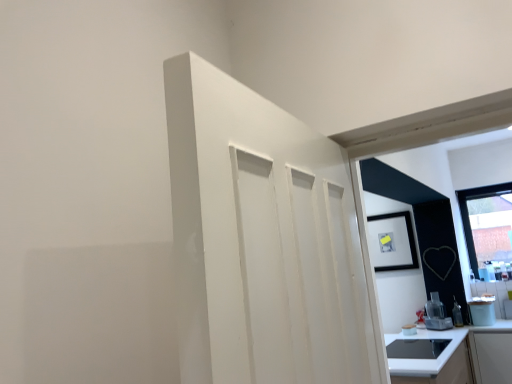
Question: Is satin silver blender at lower right, which is the second appliance from right to left, to the left of white glossy countertop at lower right from the viewer's perspective?

Choices:
 (A) no
 (B) yes

Answer: (A)

Question: From a real-world perspective, is satin silver blender at lower right, the 1th appliance positioned from the left, under white glossy countertop at lower right?

Choices:
 (A) yes
 (B) no

Answer: (B)

Question: From a real-world perspective, is satin silver blender at lower right, which is the second appliance from right to left, over white glossy countertop at lower right?

Choices:
 (A) yes
 (B) no

Answer: (A)

Question: Can you see satin silver blender at lower right, the 1th appliance positioned from the left, touching white glossy countertop at lower right?

Choices:
 (A) no
 (B) yes

Answer: (A)

Question: Is satin silver blender at lower right, the 1th appliance positioned from the left, surrounding white glossy countertop at lower right?

Choices:
 (A) yes
 (B) no

Answer: (B)

Question: From the image's perspective, is satin silver blender at lower right, the 1th appliance positioned from the left, above or below white glossy coffee maker at right, arranged as the second appliance when viewed from the left?

Choices:
 (A) above
 (B) below

Answer: (B)

Question: Looking at the image, does satin silver blender at lower right, the 1th appliance positioned from the left, seem bigger or smaller compared to white glossy coffee maker at right, which ranks as the 1th appliance in right-to-left order?

Choices:
 (A) small
 (B) big

Answer: (A)

Question: From a real-world perspective, relative to white glossy coffee maker at right, which ranks as the 1th appliance in right-to-left order, is satin silver blender at lower right, which is the second appliance from right to left, vertically above or below?

Choices:
 (A) below
 (B) above

Answer: (A)

Question: Is point (443, 319) positioned closer to the camera than point (490, 319)?

Choices:
 (A) farther
 (B) closer

Answer: (A)

Question: In the image, is satin silver blender at lower right, the 1th appliance positioned from the left, on the left side or the right side of transparent glass window at upper right?

Choices:
 (A) left
 (B) right

Answer: (A)

Question: Is satin silver blender at lower right, which is the second appliance from right to left, wider or thinner than transparent glass window at upper right?

Choices:
 (A) wide
 (B) thin

Answer: (A)

Question: In the image, is satin silver blender at lower right, which is the second appliance from right to left, positioned in front of or behind transparent glass window at upper right?

Choices:
 (A) front
 (B) behind

Answer: (A)

Question: From a real-world perspective, is satin silver blender at lower right, the 1th appliance positioned from the left, physically located above or below transparent glass window at upper right?

Choices:
 (A) below
 (B) above

Answer: (A)

Question: In the image, is white glossy countertop at lower right on the left side or the right side of satin silver blender at lower right, which is the second appliance from right to left?

Choices:
 (A) left
 (B) right

Answer: (A)

Question: From a real-world perspective, is white glossy countertop at lower right physically located above or below satin silver blender at lower right, which is the second appliance from right to left?

Choices:
 (A) above
 (B) below

Answer: (B)